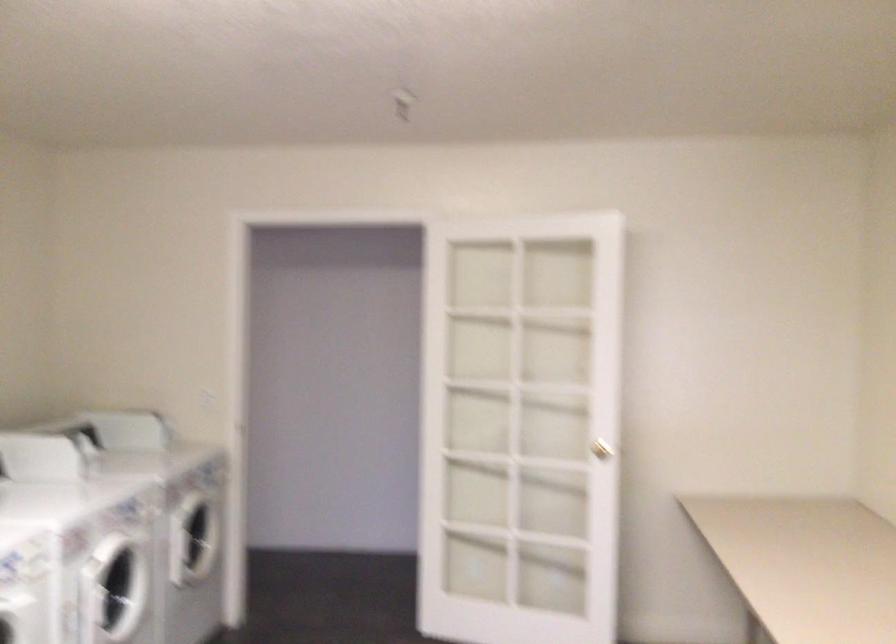
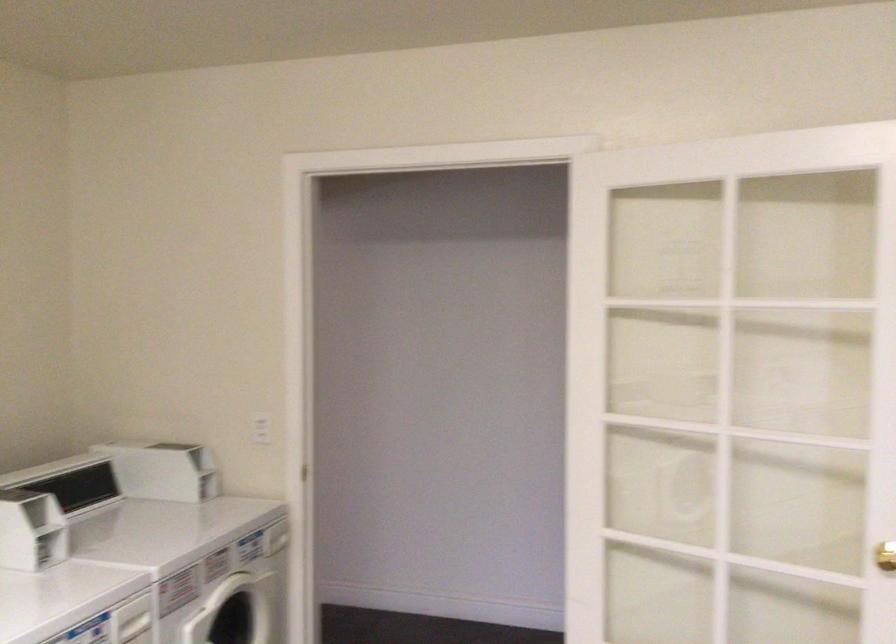
The point at (80,456) is marked in the first image. Where is the corresponding point in the second image?

(30, 529)